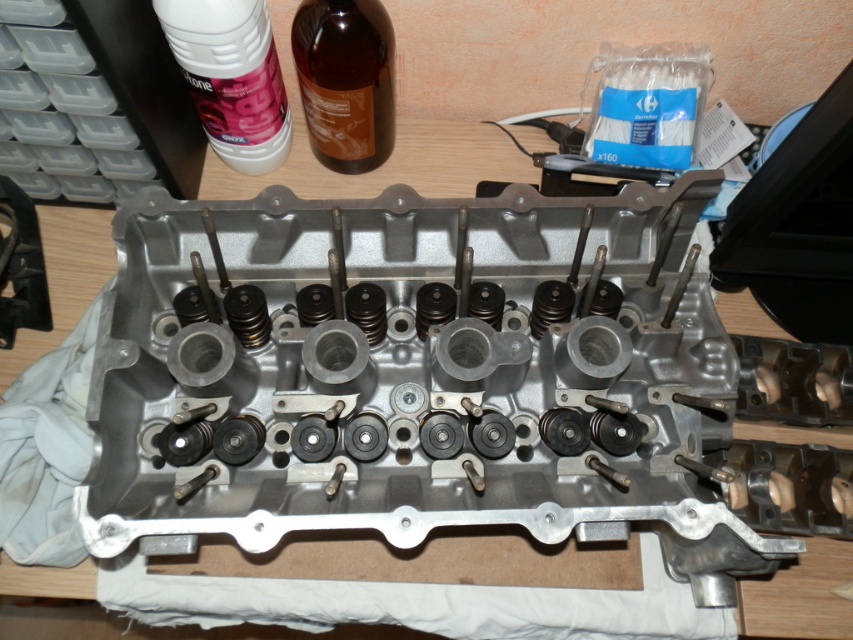
Question: Can you confirm if white plastic bottle at upper left is positioned below brown glass bottle at upper center?

Choices:
 (A) yes
 (B) no

Answer: (B)

Question: Which point appears farthest from the camera in this image?

Choices:
 (A) (x=234, y=54)
 (B) (x=368, y=36)

Answer: (B)

Question: In this image, where is white plastic bottle at upper left located relative to brown glass bottle at upper center?

Choices:
 (A) below
 (B) above

Answer: (B)

Question: Is white plastic bottle at upper left closer to the viewer compared to brown glass bottle at upper center?

Choices:
 (A) no
 (B) yes

Answer: (B)